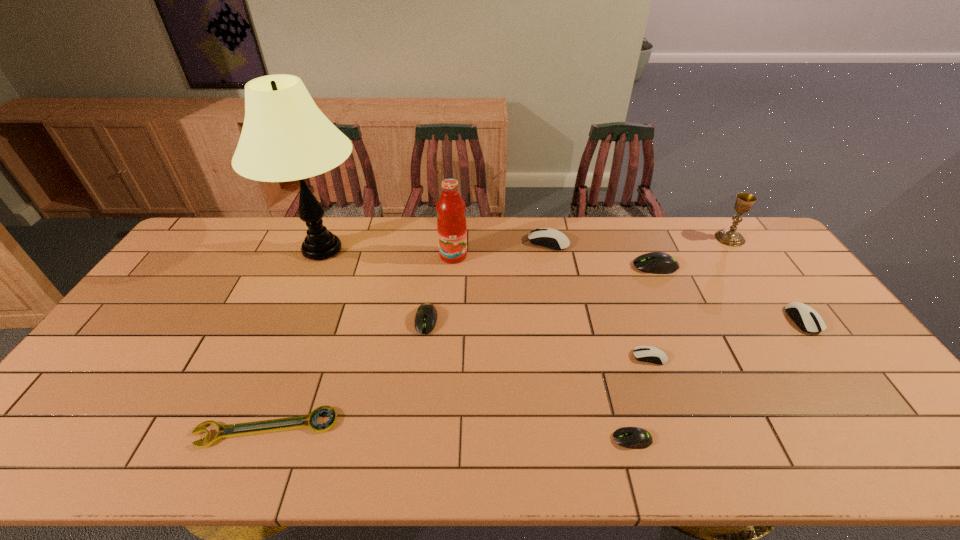
This screenshot has height=540, width=960. Find the location of `vacant space located 0.380m on the front of the third tallest object`. vacant space located 0.380m on the front of the third tallest object is located at coordinates (792, 328).

Where is `free space located on the left of the farthest computer mouse`? The width and height of the screenshot is (960, 540). free space located on the left of the farthest computer mouse is located at coordinates (483, 242).

Where is `free space located 0.230m on the wheel side of the second farthest computer mouse`? free space located 0.230m on the wheel side of the second farthest computer mouse is located at coordinates (564, 266).

Where is `vacant area located 0.310m on the wheel side of the second farthest computer mouse`? This screenshot has height=540, width=960. vacant area located 0.310m on the wheel side of the second farthest computer mouse is located at coordinates (540, 266).

In order to click on free region located on the wheel side of the second farthest computer mouse in this screenshot , I will do `click(521, 266)`.

At what (x,y) coordinates should I click in order to perform the action: click on vacant space situated 0.100m on the left of the rightmost white mouse. Please return your answer as a coordinate pair (x, y). This screenshot has width=960, height=540. Looking at the image, I should click on (756, 320).

Find the location of a particular element. This screenshot has width=960, height=540. free space located 0.220m on the wheel side of the leftmost computer mouse is located at coordinates pos(416,405).

The height and width of the screenshot is (540, 960). Identify the location of vacant area situated 0.210m on the left of the third computer mouse from right to left. (555, 357).

Find the location of `vacant space located on the wheel side of the second shortest object`. vacant space located on the wheel side of the second shortest object is located at coordinates (543, 439).

Where is `blank space located 0.160m on the wheel side of the second shortest object`? blank space located 0.160m on the wheel side of the second shortest object is located at coordinates (543, 439).